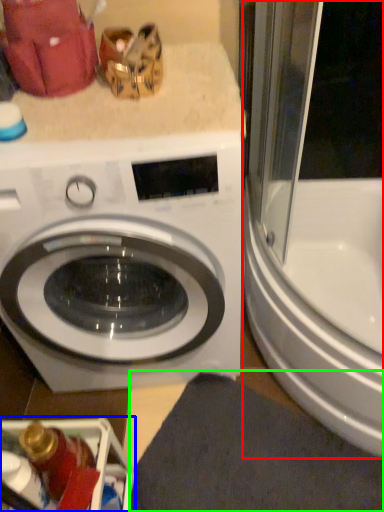
Question: Which object is positioned farthest from screen door (highlighted by a red box)? Select from dish washer (highlighted by a blue box) and bath mat (highlighted by a green box).

Choices:
 (A) dish washer
 (B) bath mat

Answer: (A)